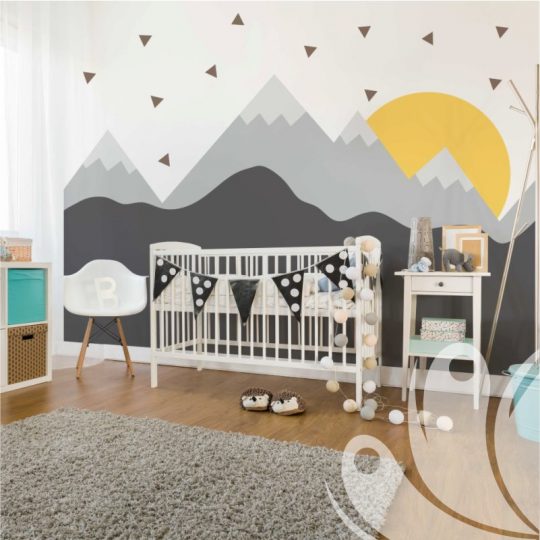
Image resolution: width=540 pixels, height=540 pixels. In order to click on storage bins in this screenshot , I will do `click(33, 303)`, `click(38, 356)`.